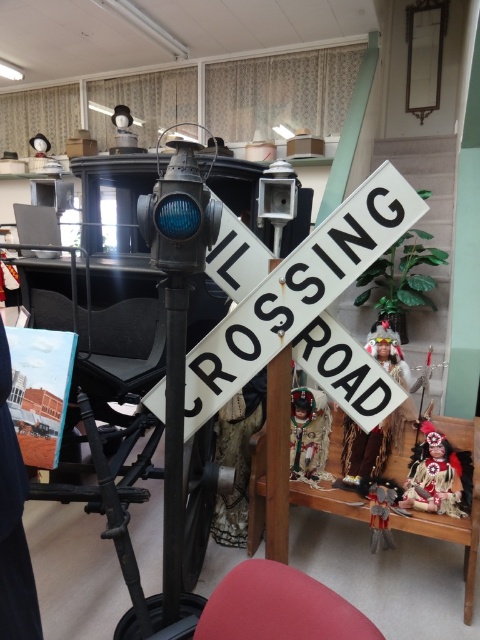
Question: Which object is the farthest from the black metal pole at center?

Choices:
 (A) velvet doll at lower right
 (B) brown fabric doll at center
 (C) matte red doll at lower right

Answer: (C)

Question: Is matte red doll at lower right to the left of velvet doll at lower right from the viewer's perspective?

Choices:
 (A) yes
 (B) no

Answer: (B)

Question: From the image, what is the correct spatial relationship of matte red doll at lower right in relation to matte brown doll at center?

Choices:
 (A) left
 (B) right

Answer: (B)

Question: Is black metal pole at center wider than matte red doll at lower right?

Choices:
 (A) no
 (B) yes

Answer: (A)

Question: Which point is farther to the camera?

Choices:
 (A) (447, 456)
 (B) (330, 420)

Answer: (B)

Question: Which object is positioned closest to the black metal pole at center?

Choices:
 (A) white matte railroad crossing sign at center
 (B) velvet doll at lower right

Answer: (A)